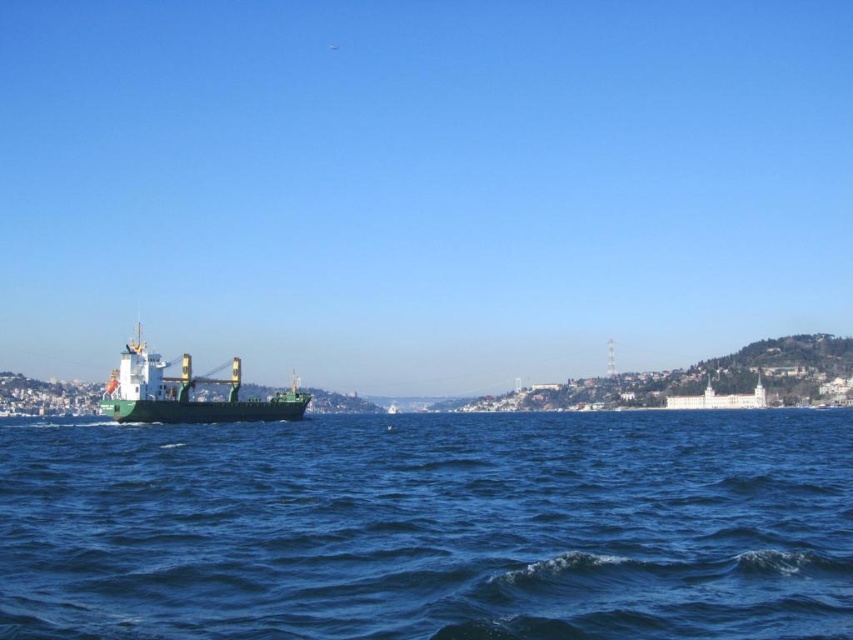
Who is higher up, blue water at center or green matte cargo ship at center?

blue water at center is higher up.

Describe the element at coordinates (430, 528) in the screenshot. This screenshot has width=853, height=640. I see `blue water at center` at that location.

Is point (428, 628) positioned behind point (242, 419)?

No.

Where is `blue water at center`? blue water at center is located at coordinates (430, 528).